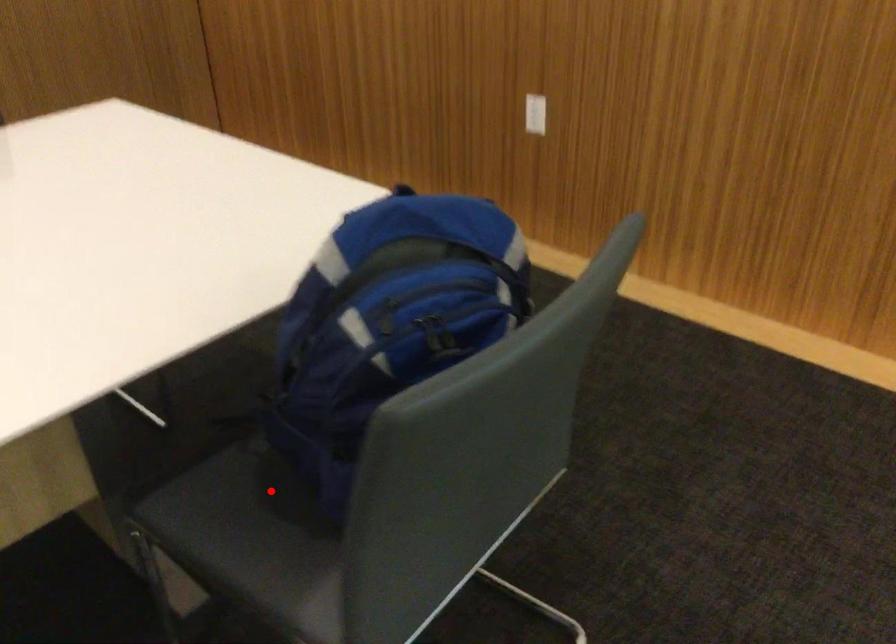
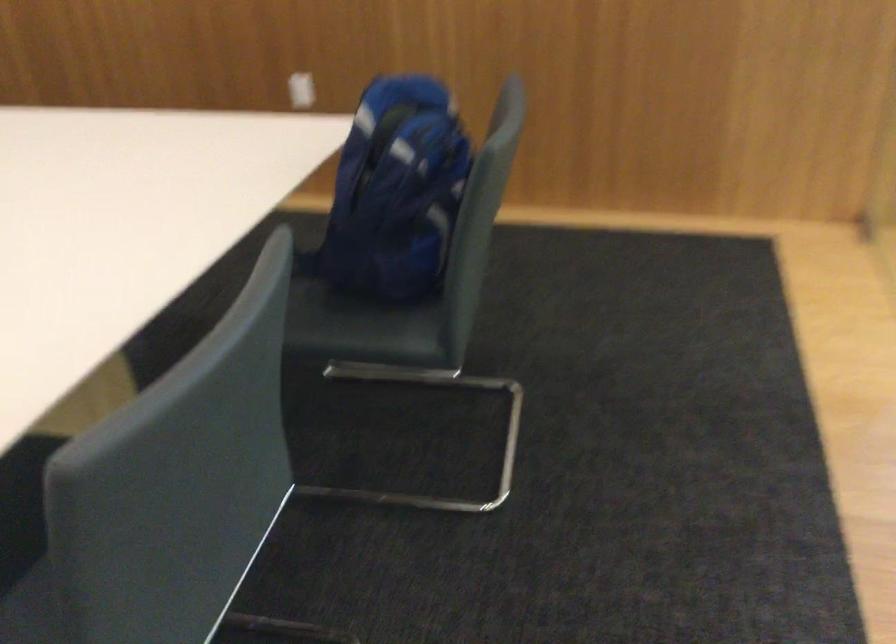
The point at the highlighted location is marked in the first image. Where is the corresponding point in the second image?

(323, 308)